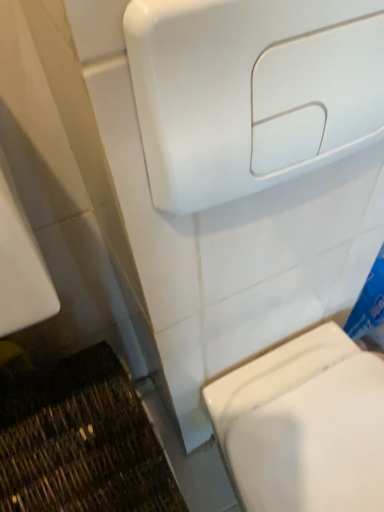
Identify the location of empty space that is ontop of white glossy toilet at lower right (from a real-world perspective). The width and height of the screenshot is (384, 512). (318, 426).